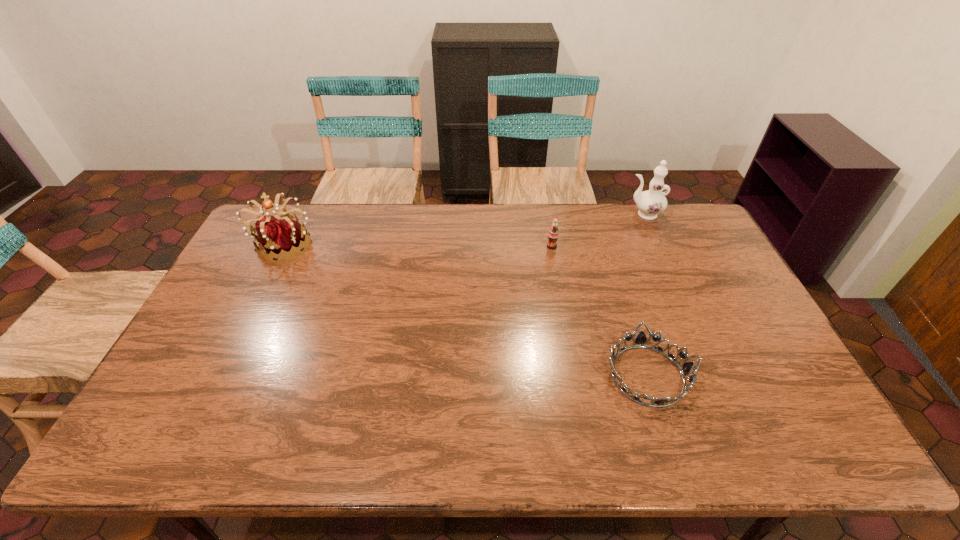
You are a GUI agent. You are given a task and a screenshot of the screen. Output one action in this format:
    pyautogui.click(x=<x>, y=<y>)
    Task: Click on the free location located 0.180m on the front-facing side of the taller tiara
    The height and width of the screenshot is (540, 960).
    Given the screenshot: What is the action you would take?
    pyautogui.click(x=254, y=305)

Find the location of a particular element. The width and height of the screenshot is (960, 540). free point located 0.170m on the left of the third object from right to left is located at coordinates (497, 247).

Identify the location of free location located on the front-facing side of the nearest object. (548, 375).

Where is `vacant space located 0.260m on the front-facing side of the nearest object`? vacant space located 0.260m on the front-facing side of the nearest object is located at coordinates (502, 375).

Identify the location of vacant space located on the front-facing side of the nearest object. The image size is (960, 540). (584, 375).

At what (x,y) coordinates should I click in order to perform the action: click on chinaware that is at the far edge. Please return your answer as a coordinate pair (x, y). The height and width of the screenshot is (540, 960). Looking at the image, I should click on (650, 203).

This screenshot has width=960, height=540. I want to click on tiara positioned at the far edge, so click(282, 237).

In order to click on soda that is positioned at the far edge in this screenshot , I will do `click(553, 234)`.

I want to click on object that is at the left edge, so click(x=282, y=237).

Locate an element on the screen. object located in the right edge section of the desktop is located at coordinates (650, 203).